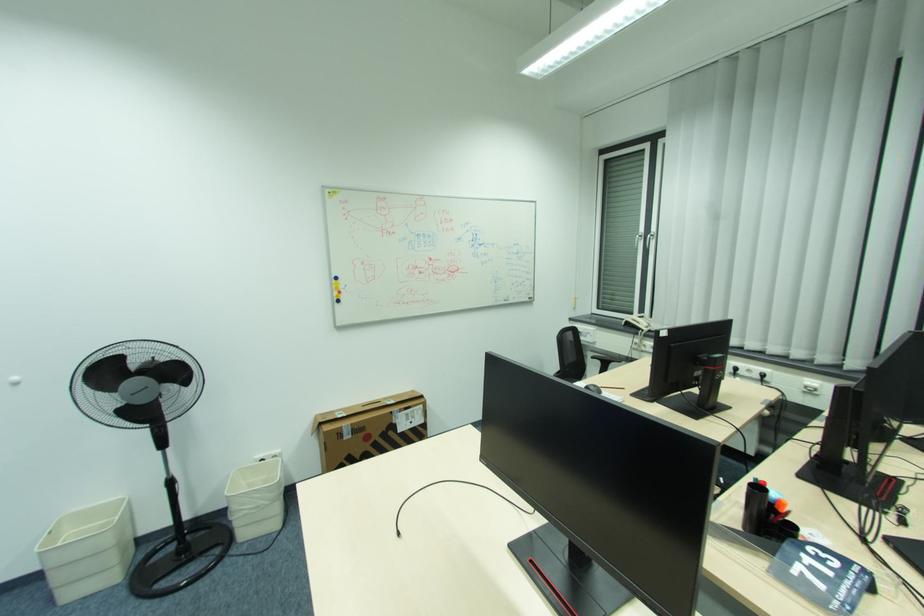
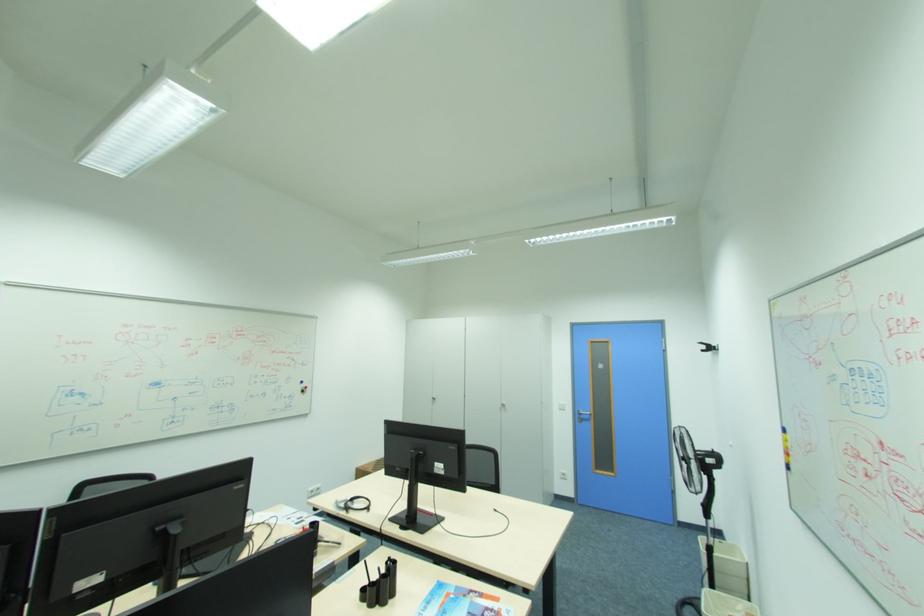
Locate, in the second image, the point that corresponds to the point at 346,286 in the first image.

(794, 446)